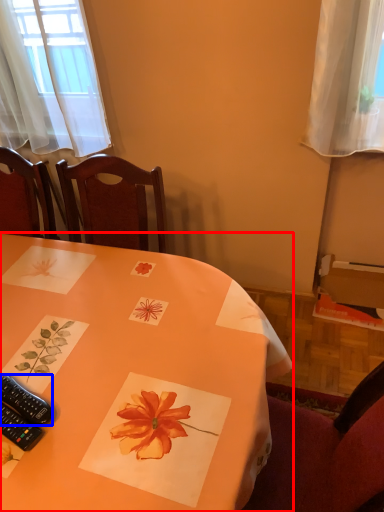
Question: Among these objects, which one is nearest to the camera, table (highlighted by a red box) or remote control (highlighted by a blue box)?

Choices:
 (A) table
 (B) remote control

Answer: (A)